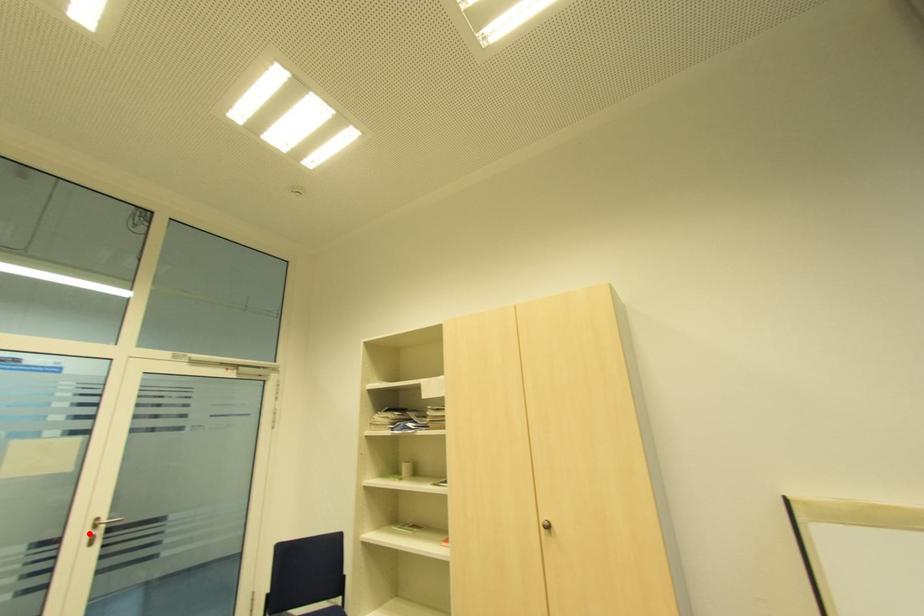
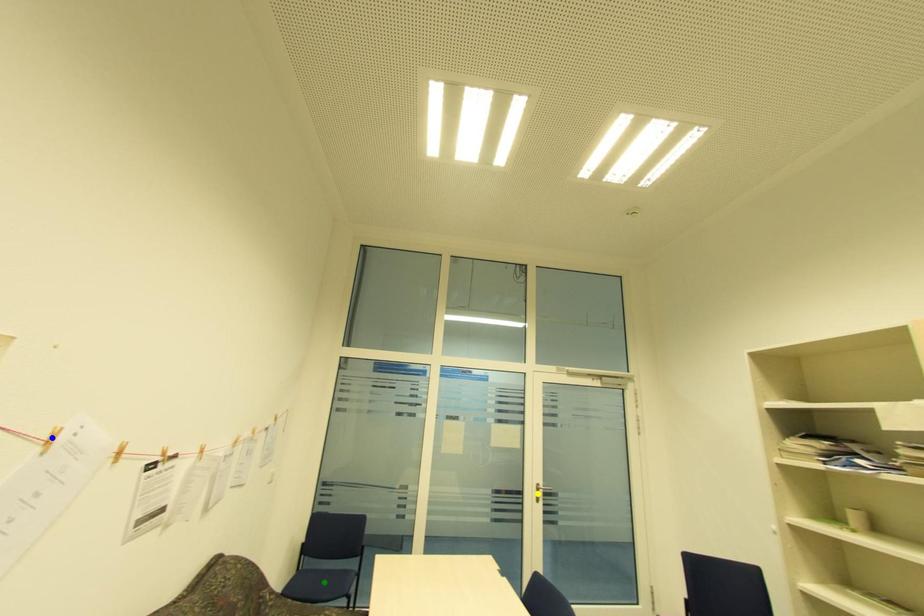
Question: I am providing you with two images of the same scene from different viewpoints. A red point is marked on the first image. You are given multiple points on the second image. Which mark in image 2 goes with the point in image 1?

Choices:
 (A) yellow point
 (B) blue point
 (C) green point

Answer: (A)